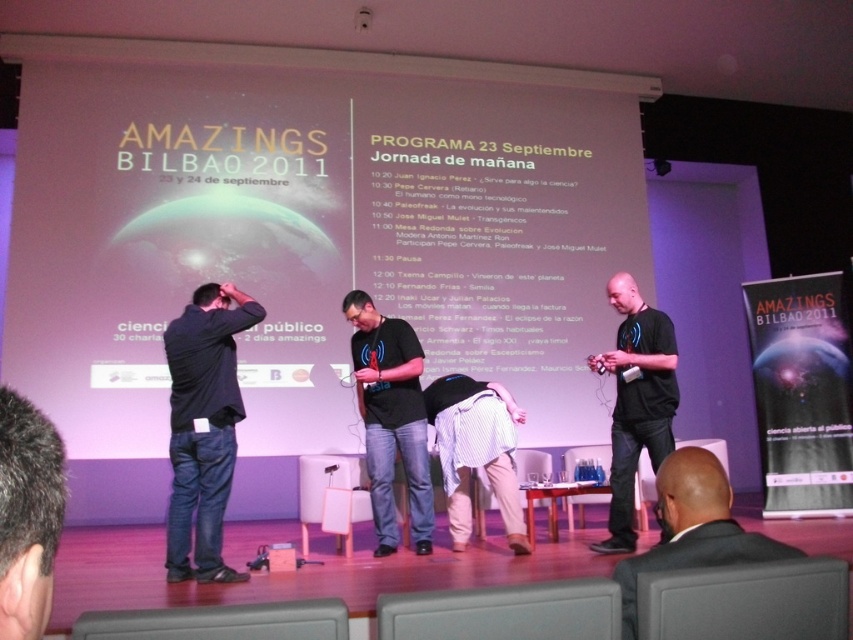
You are attending the event and want to take a photo of the dark brown hair at lower left and the striped fabric shirt at center. Which one should you focus on first to ensure both are in focus?

You should focus on the dark brown hair at lower left first because it is closer to you than the striped fabric shirt at center. By focusing on the closer object, the farther one may still be in focus depending on the camera settings.

You are a photographer positioned at the front of the conference hall. You want to take a photo that includes both the large screen with the event details and a specific point on the stage. The two points you need to include are point (428, 202) and point (51, 476). Given their positions, which point is closer to the camera and should be framed first to ensure both are in focus?

Point (51, 476) is closer to the camera than point (428, 202). To ensure both are in focus, frame the photo starting with the closer point, point (51, 476), and adjust the focus to include the further point, point (428, 202).

You are a photographer at the AMAZINGS BILBAO 2011 event. You need to capture a photo of the dark brown hair at lower left and the striped fabric shirt at center. Which object should you zoom in more on to ensure both are clearly visible in the photo?

Since the dark brown hair at lower left is narrower than the striped fabric shirt at center, you should zoom in more on the dark brown hair at lower left to ensure both are clearly visible in the photo.